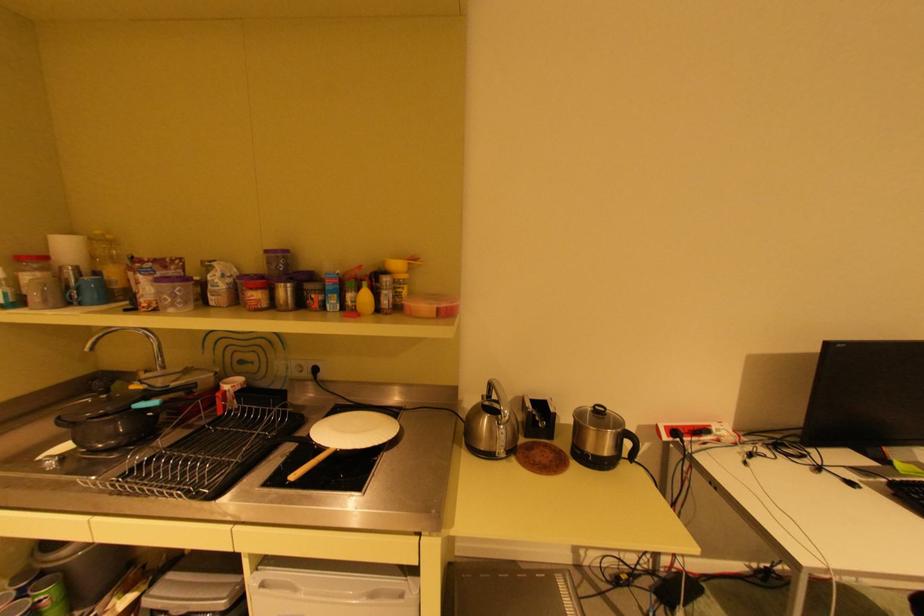
Find where to lift the purple lidded container. Please return your answer as a coordinate pair (x, y).

(276, 262)